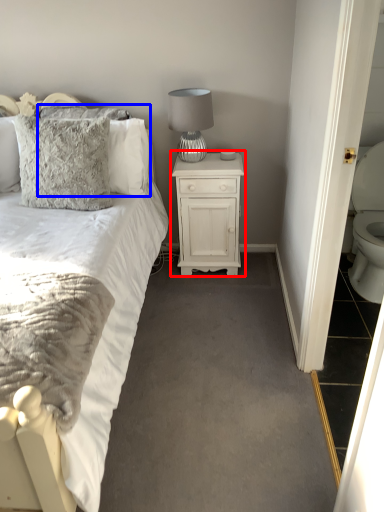
Question: Which of the following is the farthest to the observer, nightstand (highlighted by a red box) or pillow (highlighted by a blue box)?

Choices:
 (A) nightstand
 (B) pillow

Answer: (A)